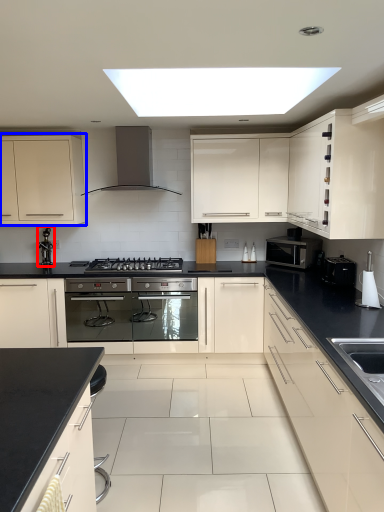
Question: Which object is closer to the camera taking this photo, faucet (highlighted by a red box) or cabinetry (highlighted by a blue box)?

Choices:
 (A) faucet
 (B) cabinetry

Answer: (B)